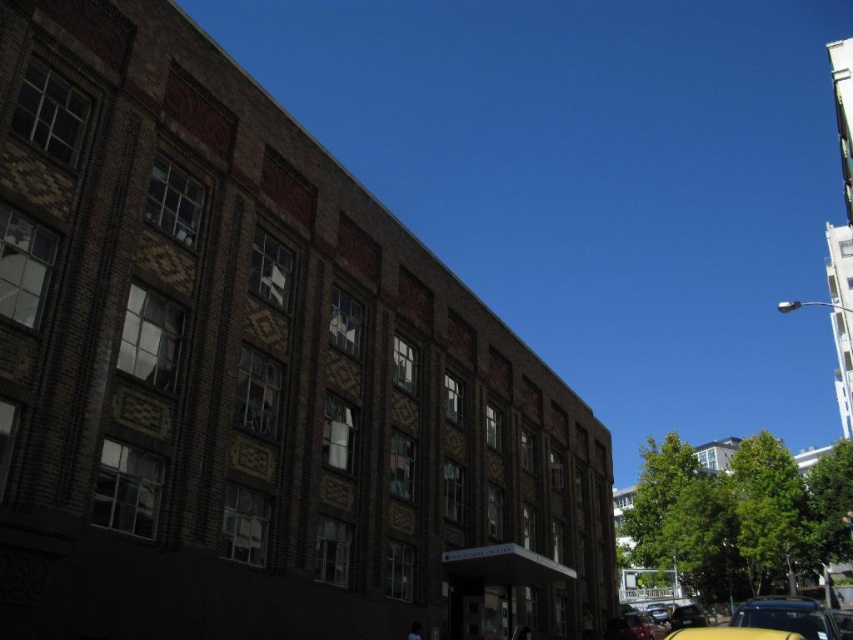
Image resolution: width=853 pixels, height=640 pixels. Describe the element at coordinates (787, 616) in the screenshot. I see `yellow matte car at lower right` at that location.

Does yellow matte car at lower right lie behind yellow rubber taxi at lower right?

That is True.

Identify the location of yellow matte car at lower right. (787, 616).

The image size is (853, 640). In order to click on yellow matte car at lower right in this screenshot , I will do `click(787, 616)`.

Can you confirm if yellow matte car at lower right is bigger than shiny black car at lower right?

Indeed, yellow matte car at lower right has a larger size compared to shiny black car at lower right.

Does point (793, 628) come in front of point (635, 611)?

Yes, point (793, 628) is in front of point (635, 611).

You are a GUI agent. You are given a task and a screenshot of the screen. Output one action in this format:
    pyautogui.click(x=<x>, y=<y>)
    Task: Click on the yellow matte car at lower right
    
    Given the screenshot: What is the action you would take?
    pyautogui.click(x=787, y=616)

Is point (694, 632) positioned before point (631, 628)?

Yes, it is.

Looking at this image, who is lower down, yellow rubber taxi at lower right or shiny black car at lower right?

shiny black car at lower right is lower down.

Is point (718, 634) behind point (645, 628)?

No, it is in front of (645, 628).

Where is `yellow rubber taxi at lower right`? yellow rubber taxi at lower right is located at coordinates (730, 634).